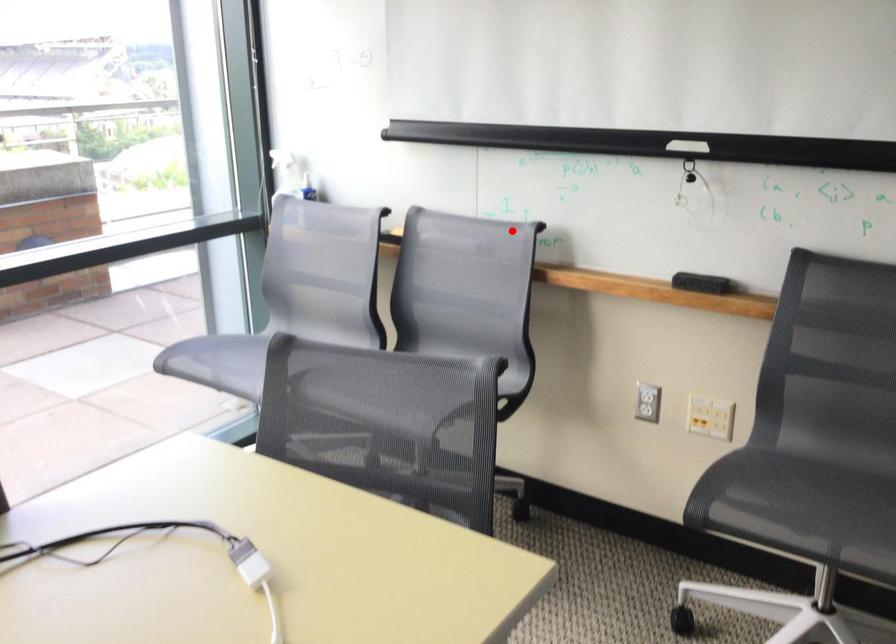
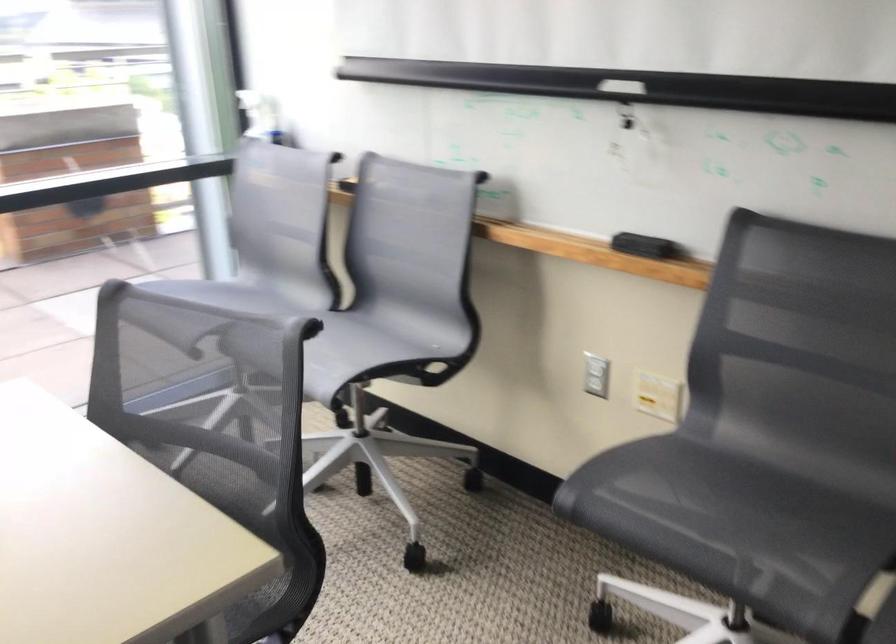
Find the pixel in the second image that matches the highlighted location in the first image.

(457, 182)